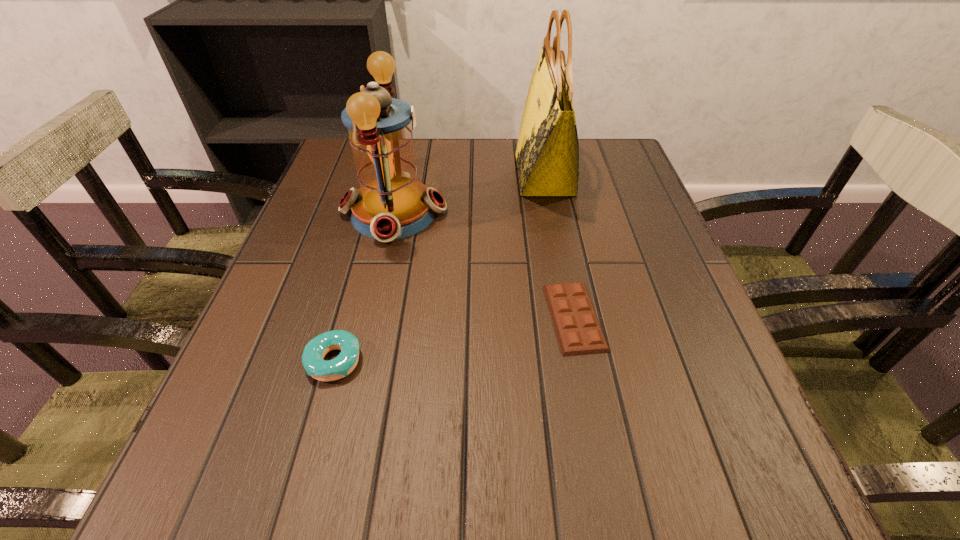
You are a GUI agent. You are given a task and a screenshot of the screen. Output one action in this format:
    pyautogui.click(x=<x>, y=<y>)
    Task: Click on the tote bag that is at the far edge
    The width and height of the screenshot is (960, 540).
    Given the screenshot: What is the action you would take?
    pyautogui.click(x=547, y=155)

This screenshot has width=960, height=540. Identify the location of lantern situated at the far edge. (391, 204).

In order to click on lantern that is positioned at the left edge in this screenshot , I will do `click(391, 204)`.

Where is `doughnut situated at the left edge`? The width and height of the screenshot is (960, 540). doughnut situated at the left edge is located at coordinates (314, 352).

Locate an element on the screen. The height and width of the screenshot is (540, 960). object that is at the far left corner is located at coordinates (391, 204).

This screenshot has height=540, width=960. I want to click on blank space at the far edge, so click(457, 178).

Where is `vacant space at the near edge of the desktop`? Image resolution: width=960 pixels, height=540 pixels. vacant space at the near edge of the desktop is located at coordinates pyautogui.click(x=398, y=485).

Where is `vacant area at the left edge of the desktop`? vacant area at the left edge of the desktop is located at coordinates (302, 263).

At what (x,y) coordinates should I click in order to perform the action: click on free location at the right edge. Please return your answer as a coordinate pair (x, y). Image resolution: width=960 pixels, height=540 pixels. Looking at the image, I should click on (646, 376).

This screenshot has height=540, width=960. In order to click on free space at the far left corner in this screenshot , I will do pyautogui.click(x=317, y=181).